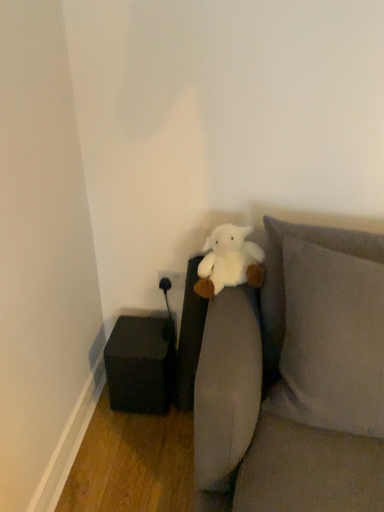
Question: Is black matte cube at lower left facing towards soft gray fabric couch at center?

Choices:
 (A) yes
 (B) no

Answer: (B)

Question: Considering the relative sizes of black matte cube at lower left and soft gray fabric couch at center in the image provided, is black matte cube at lower left smaller than soft gray fabric couch at center?

Choices:
 (A) yes
 (B) no

Answer: (A)

Question: From a real-world perspective, is black matte cube at lower left located beneath soft gray fabric couch at center?

Choices:
 (A) yes
 (B) no

Answer: (A)

Question: Is black matte cube at lower left taller than soft gray fabric couch at center?

Choices:
 (A) no
 (B) yes

Answer: (A)

Question: Can we say black matte cube at lower left lies outside soft gray fabric couch at center?

Choices:
 (A) no
 (B) yes

Answer: (B)

Question: Is black matte cube at lower left to the left of soft gray fabric couch at center from the viewer's perspective?

Choices:
 (A) no
 (B) yes

Answer: (B)

Question: From a real-world perspective, is white plush at center on top of black matte cube at lower left?

Choices:
 (A) no
 (B) yes

Answer: (B)

Question: From the image's perspective, is white plush at center below black matte cube at lower left?

Choices:
 (A) no
 (B) yes

Answer: (A)

Question: Considering the relative sizes of white plush at center and black matte cube at lower left in the image provided, is white plush at center bigger than black matte cube at lower left?

Choices:
 (A) yes
 (B) no

Answer: (B)

Question: Is white plush at center smaller than black matte cube at lower left?

Choices:
 (A) no
 (B) yes

Answer: (B)

Question: Is white plush at center thinner than black matte cube at lower left?

Choices:
 (A) no
 (B) yes

Answer: (B)

Question: Is black matte cube at lower left at the back of white plush at center?

Choices:
 (A) yes
 (B) no

Answer: (B)

Question: Is black matte cube at lower left positioned before white plush at center?

Choices:
 (A) yes
 (B) no

Answer: (B)